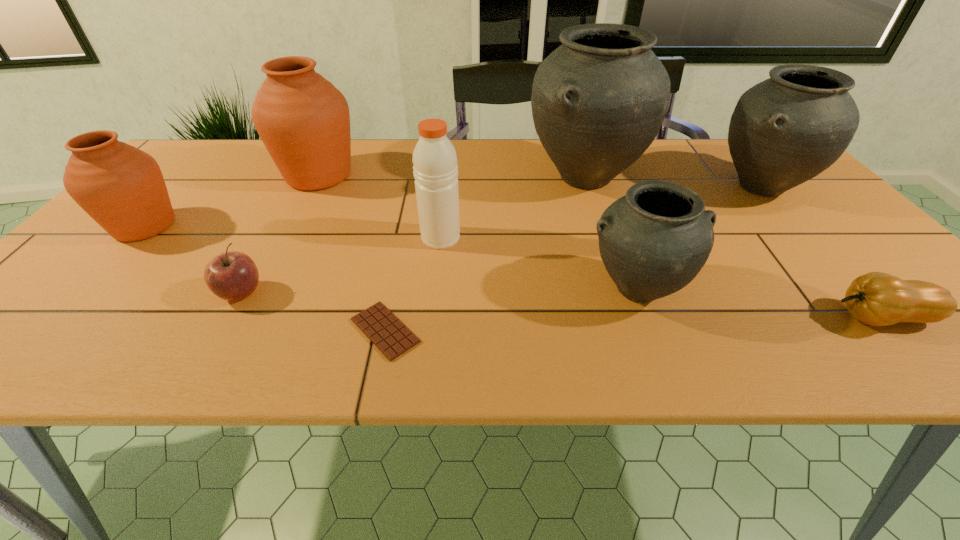
This screenshot has height=540, width=960. What are the coordinates of `vacant space that satisfies the following two spatial constraints: 1. on the front side of the brown candy bar; 2. on the left side of the bigger brown urn` in the screenshot? It's located at (238, 330).

Locate an element on the screen. This screenshot has height=540, width=960. vacant space that satisfies the following two spatial constraints: 1. on the front side of the candy bar; 2. on the left side of the apple is located at coordinates (221, 330).